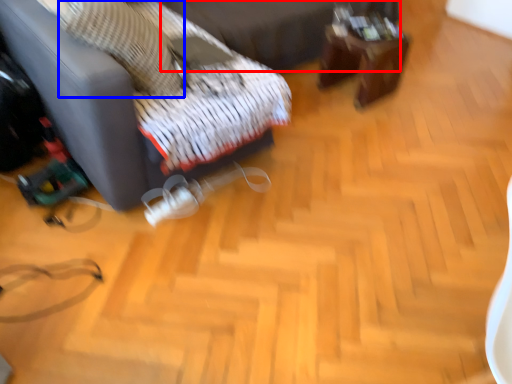
Question: Which object appears farthest to the camera in this image, bed frame (highlighted by a red box) or pillow (highlighted by a blue box)?

Choices:
 (A) bed frame
 (B) pillow

Answer: (A)